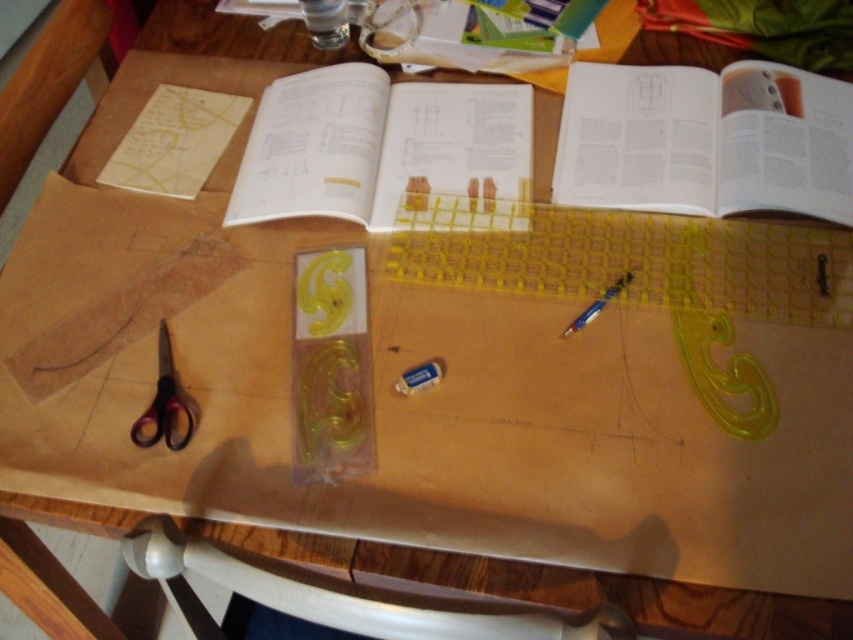
Is white paper book at upper right smaller than white paper at center?

Actually, white paper book at upper right might be larger than white paper at center.

Can you confirm if white paper book at upper right is positioned to the left of white paper at center?

Incorrect, white paper book at upper right is not on the left side of white paper at center.

Where is `white paper book at upper right`? Image resolution: width=853 pixels, height=640 pixels. white paper book at upper right is located at coordinates (705, 140).

Which of these two, black plastic scissors at lower left or white matte eraser at center, stands shorter?

white matte eraser at center

From the picture: Can you confirm if black plastic scissors at lower left is wider than white matte eraser at center?

Yes.

What are the coordinates of `black plastic scissors at lower left` in the screenshot? It's located at pos(163,404).

Locate an element on the screen. This screenshot has height=640, width=853. black plastic scissors at lower left is located at coordinates click(163, 404).

Which is below, white paper book at upper right or white matte eraser at center?

white matte eraser at center is lower down.

Locate an element on the screen. white paper book at upper right is located at coordinates (705, 140).

At what (x,y) coordinates should I click in order to perform the action: click on white paper book at upper right. Please return your answer as a coordinate pair (x, y). Looking at the image, I should click on [705, 140].

Find the location of a particular element. The image size is (853, 640). white paper book at upper right is located at coordinates (705, 140).